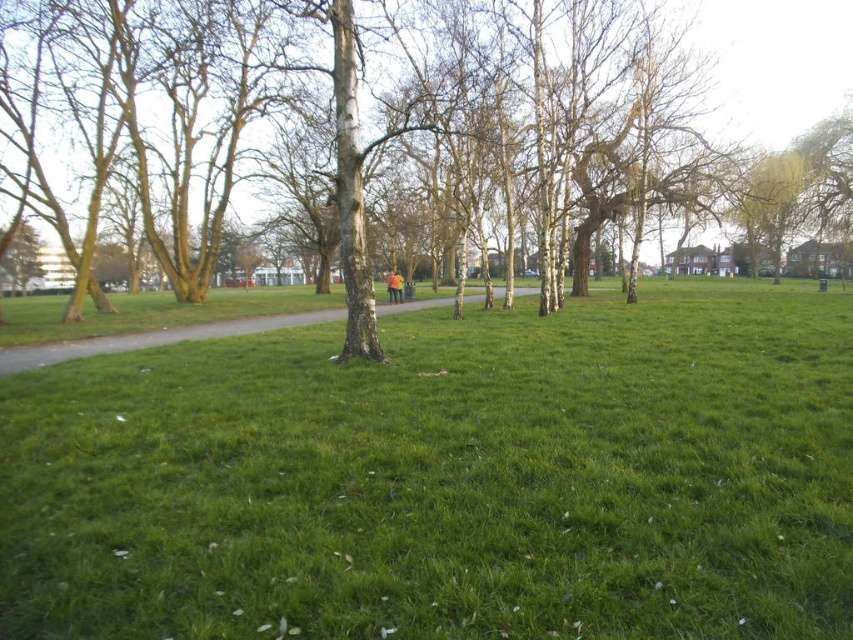
Looking at this image, you are standing at the edge of the park and want to walk to the gravel path at center. There is a green bark tree at center blocking your way. Can you walk around the tree to reach the path?

The green bark tree at center is 13.10 meters away from the gravel path at center, so you can walk around the tree to reach the gravel path at center since there is enough space between them.

You are a gardener planning to mow the green grassy at center and gravel path at center. Which area requires a wider mower blade to accommodate its width?

The green grassy at center might be wider than gravel path at center, so the gardener should use a wider mower blade for the green grassy at center.